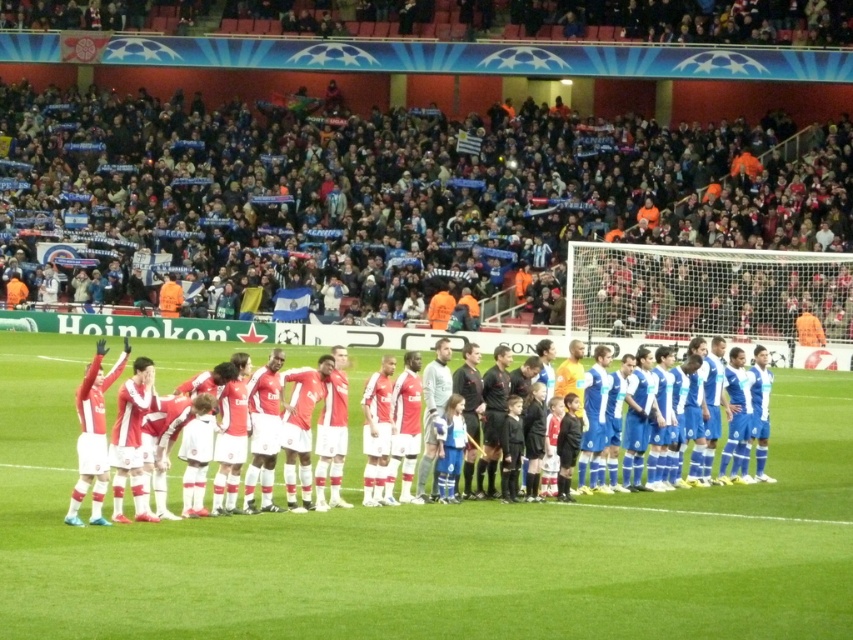
Question: Can you confirm if dark blue fabric crowd at upper center is positioned below matte red jersey at center?

Choices:
 (A) yes
 (B) no

Answer: (B)

Question: Which object appears closest to the camera in this image?

Choices:
 (A) dark blue fabric crowd at upper center
 (B) matte red jersey at center

Answer: (B)

Question: Is dark blue fabric crowd at upper center above matte red jersey at center?

Choices:
 (A) no
 (B) yes

Answer: (B)

Question: Where is dark blue fabric crowd at upper center located in relation to matte red jersey at center in the image?

Choices:
 (A) above
 (B) below

Answer: (A)

Question: Which point is farther to the camera?

Choices:
 (A) (850, 172)
 (B) (527, 369)

Answer: (A)